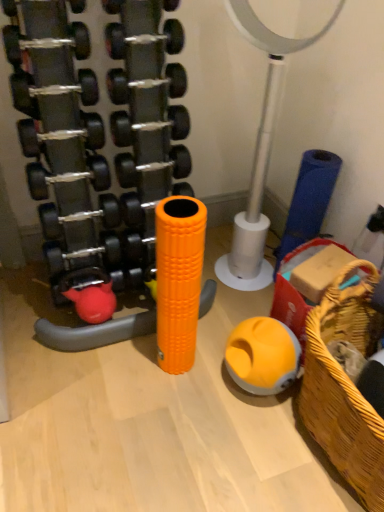
Based on the photo, measure the distance between woven wood basket at lower right and camera.

The distance of woven wood basket at lower right from camera is 95.74 centimeters.

What is the approximate height of orange foam roller at center, marked as the first toy in a left-to-right arrangement?

26.20 inches.

Where is `rubberized yellow ball at center, which ranks as the 1th toy in right-to-left order`? The width and height of the screenshot is (384, 512). rubberized yellow ball at center, which ranks as the 1th toy in right-to-left order is located at coordinates (262, 356).

Where is `basketball hoop above the orange foam roller at center, marked as the first toy in a left-to-right arrangement (from a real-world perspective)`? This screenshot has height=512, width=384. basketball hoop above the orange foam roller at center, marked as the first toy in a left-to-right arrangement (from a real-world perspective) is located at coordinates click(x=259, y=152).

Which is more to the right, metallic silver basketball hoop at center or orange foam roller at center, marked as the first toy in a left-to-right arrangement?

metallic silver basketball hoop at center.

From a real-world perspective, is metallic silver basketball hoop at center physically below orange foam roller at center, the 2th toy positioned from the right?

Incorrect, from a real-world perspective, metallic silver basketball hoop at center is higher than orange foam roller at center, the 2th toy positioned from the right.

Is metallic silver basketball hoop at center not near orange foam roller at center, the 2th toy positioned from the right?

Actually, metallic silver basketball hoop at center and orange foam roller at center, the 2th toy positioned from the right, are a little close together.

Which is more to the right, metallic silver basketball hoop at center or rubberized yellow ball at center, which appears as the second toy when viewed from the left?

metallic silver basketball hoop at center.

Considering the sizes of objects metallic silver basketball hoop at center and rubberized yellow ball at center, which ranks as the 1th toy in right-to-left order, in the image provided, who is bigger, metallic silver basketball hoop at center or rubberized yellow ball at center, which ranks as the 1th toy in right-to-left order,?

With larger size is metallic silver basketball hoop at center.

How distant is metallic silver basketball hoop at center from rubberized yellow ball at center, which appears as the second toy when viewed from the left?

They are 21.47 inches apart.

Is there a large distance between metallic silver basketball hoop at center and rubberized yellow ball at center, which appears as the second toy when viewed from the left?

No, metallic silver basketball hoop at center is in close proximity to rubberized yellow ball at center, which appears as the second toy when viewed from the left.

Considering their positions, is rubberized yellow ball at center, which appears as the second toy when viewed from the left, located in front of or behind woven wood basket at lower right?

In the image, rubberized yellow ball at center, which appears as the second toy when viewed from the left, appears behind woven wood basket at lower right.

Is rubberized yellow ball at center, which appears as the second toy when viewed from the left, not close to woven wood basket at lower right?

Actually, rubberized yellow ball at center, which appears as the second toy when viewed from the left, and woven wood basket at lower right are a little close together.

From the image's perspective, would you say rubberized yellow ball at center, which ranks as the 1th toy in right-to-left order, is positioned over woven wood basket at lower right?

Correct, rubberized yellow ball at center, which ranks as the 1th toy in right-to-left order, appears higher than woven wood basket at lower right in the image.

From the image's perspective, is woven wood basket at lower right located above or below orange foam roller at center, marked as the first toy in a left-to-right arrangement?

From the image's perspective, woven wood basket at lower right appears below orange foam roller at center, marked as the first toy in a left-to-right arrangement.

Is point (343, 458) positioned in front of point (166, 237)?

No, it is not.

Is woven wood basket at lower right positioned beyond the bounds of orange foam roller at center, marked as the first toy in a left-to-right arrangement?

Yes, woven wood basket at lower right is located beyond the bounds of orange foam roller at center, marked as the first toy in a left-to-right arrangement.

Is woven wood basket at lower right aimed at orange foam roller at center, marked as the first toy in a left-to-right arrangement?

No, woven wood basket at lower right is not facing towards orange foam roller at center, marked as the first toy in a left-to-right arrangement.

Considering the sizes of objects orange foam roller at center, marked as the first toy in a left-to-right arrangement, and woven wood basket at lower right in the image provided, who is bigger, orange foam roller at center, marked as the first toy in a left-to-right arrangement, or woven wood basket at lower right?

With larger size is woven wood basket at lower right.

Can you confirm if orange foam roller at center, marked as the first toy in a left-to-right arrangement, is thinner than woven wood basket at lower right?

Correct, the width of orange foam roller at center, marked as the first toy in a left-to-right arrangement, is less than that of woven wood basket at lower right.

Is orange foam roller at center, the 2th toy positioned from the right, outside of woven wood basket at lower right?

Yes, orange foam roller at center, the 2th toy positioned from the right, is not within woven wood basket at lower right.

Which is more to the left, orange foam roller at center, the 2th toy positioned from the right, or woven wood basket at lower right?

From the viewer's perspective, orange foam roller at center, the 2th toy positioned from the right, appears more on the left side.

Between woven wood basket at lower right and metallic silver basketball hoop at center, which one has more height?

Standing taller between the two is metallic silver basketball hoop at center.

What's the angular difference between woven wood basket at lower right and metallic silver basketball hoop at center's facing directions?

There is a 88.9-degree angle between the facing directions of woven wood basket at lower right and metallic silver basketball hoop at center.

Between point (367, 305) and point (249, 13), which one is positioned in front?

The point (249, 13) is closer.

Considering their positions, is woven wood basket at lower right located in front of or behind metallic silver basketball hoop at center?

In the image, woven wood basket at lower right appears in front of metallic silver basketball hoop at center.

From the image's perspective, is metallic silver basketball hoop at center under woven wood basket at lower right?

Incorrect, from the image's perspective, metallic silver basketball hoop at center is higher than woven wood basket at lower right.

Is metallic silver basketball hoop at center inside the boundaries of woven wood basket at lower right, or outside?

metallic silver basketball hoop at center cannot be found inside woven wood basket at lower right.

Which object is positioned more to the left, metallic silver basketball hoop at center or woven wood basket at lower right?

From the viewer's perspective, metallic silver basketball hoop at center appears more on the left side.

Where is `basketball hoop in front of the orange foam roller at center, marked as the first toy in a left-to-right arrangement`? The image size is (384, 512). basketball hoop in front of the orange foam roller at center, marked as the first toy in a left-to-right arrangement is located at coordinates click(259, 152).

Find the location of a particular element. basketball hoop above the rubberized yellow ball at center, which ranks as the 1th toy in right-to-left order (from a real-world perspective) is located at coordinates (259, 152).

When comparing their distances from metallic silver basketball hoop at center, does woven wood basket at lower right or orange foam roller at center, the 2th toy positioned from the right, seem closer?

orange foam roller at center, the 2th toy positioned from the right, is positioned closer to the anchor metallic silver basketball hoop at center.

Which object lies nearer to the anchor point metallic silver basketball hoop at center, rubberized yellow ball at center, which ranks as the 1th toy in right-to-left order, or woven wood basket at lower right?

rubberized yellow ball at center, which ranks as the 1th toy in right-to-left order, lies closer to metallic silver basketball hoop at center than the other object.

Consider the image. When comparing their distances from rubberized yellow ball at center, which ranks as the 1th toy in right-to-left order, does metallic silver basketball hoop at center or orange foam roller at center, marked as the first toy in a left-to-right arrangement, seem closer?

orange foam roller at center, marked as the first toy in a left-to-right arrangement, is closer to rubberized yellow ball at center, which ranks as the 1th toy in right-to-left order.

Looking at the image, which one is located closer to orange foam roller at center, the 2th toy positioned from the right, metallic silver basketball hoop at center or woven wood basket at lower right?

metallic silver basketball hoop at center lies closer to orange foam roller at center, the 2th toy positioned from the right, than the other object.

Estimate the real-world distances between objects in this image. Which object is further from orange foam roller at center, the 2th toy positioned from the right, woven wood basket at lower right or metallic silver basketball hoop at center?

woven wood basket at lower right lies further to orange foam roller at center, the 2th toy positioned from the right, than the other object.

From the image, which object appears to be farther from orange foam roller at center, marked as the first toy in a left-to-right arrangement, woven wood basket at lower right or rubberized yellow ball at center, which ranks as the 1th toy in right-to-left order?

woven wood basket at lower right is positioned further to the anchor orange foam roller at center, marked as the first toy in a left-to-right arrangement.

Which object lies further to the anchor point orange foam roller at center, marked as the first toy in a left-to-right arrangement, metallic silver basketball hoop at center or rubberized yellow ball at center, which ranks as the 1th toy in right-to-left order?

metallic silver basketball hoop at center.

From the image, which object appears to be farther from metallic silver basketball hoop at center, woven wood basket at lower right or rubberized yellow ball at center, which ranks as the 1th toy in right-to-left order?

The object further to metallic silver basketball hoop at center is woven wood basket at lower right.

Where is `toy between orange foam roller at center, the 2th toy positioned from the right, and woven wood basket at lower right`? toy between orange foam roller at center, the 2th toy positioned from the right, and woven wood basket at lower right is located at coordinates (262, 356).

This screenshot has width=384, height=512. Find the location of `toy between metallic silver basketball hoop at center and rubberized yellow ball at center, which appears as the second toy when viewed from the left, in the up-down direction`. toy between metallic silver basketball hoop at center and rubberized yellow ball at center, which appears as the second toy when viewed from the left, in the up-down direction is located at coordinates (178, 279).